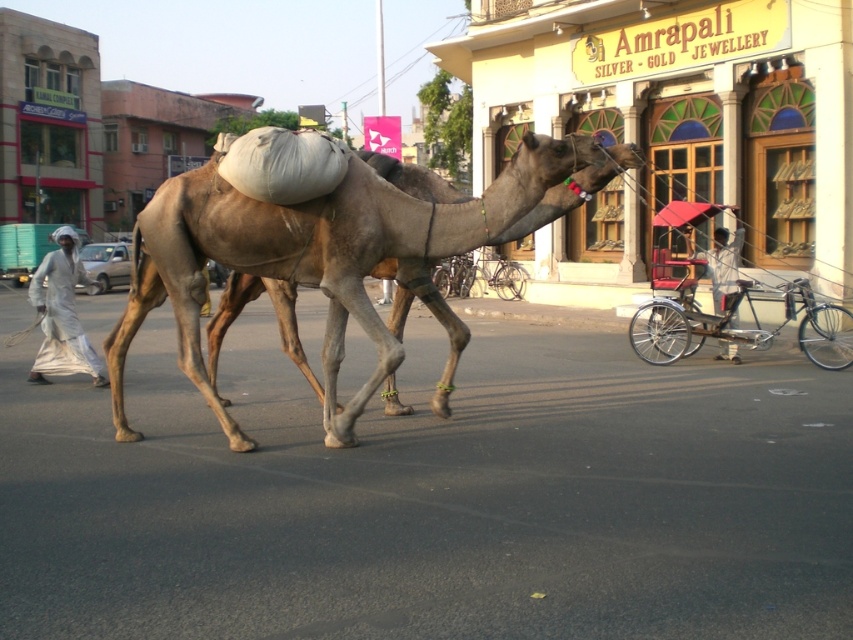
Question: Which object is positioned farthest from the white fabric cart at center?

Choices:
 (A) brown matte camel at center
 (B) metallic silver rickshaw at right
 (C) white cotton clothing at left

Answer: (C)

Question: Can you confirm if metallic silver rickshaw at right is positioned to the right of white fabric cart at center?

Choices:
 (A) yes
 (B) no

Answer: (B)

Question: Is white cotton clothing at left closer to camera compared to white fabric cart at center?

Choices:
 (A) no
 (B) yes

Answer: (B)

Question: Which is nearer to the white fabric cart at center?

Choices:
 (A) white cotton clothing at left
 (B) brown matte camel at center
 (C) metallic silver rickshaw at right

Answer: (C)

Question: Based on their relative distances, which object is farther from the brown matte camel at center?

Choices:
 (A) white fabric cart at center
 (B) white cotton clothing at left
 (C) metallic silver rickshaw at right

Answer: (A)

Question: Is brown matte camel at center below white fabric cart at center?

Choices:
 (A) yes
 (B) no

Answer: (A)